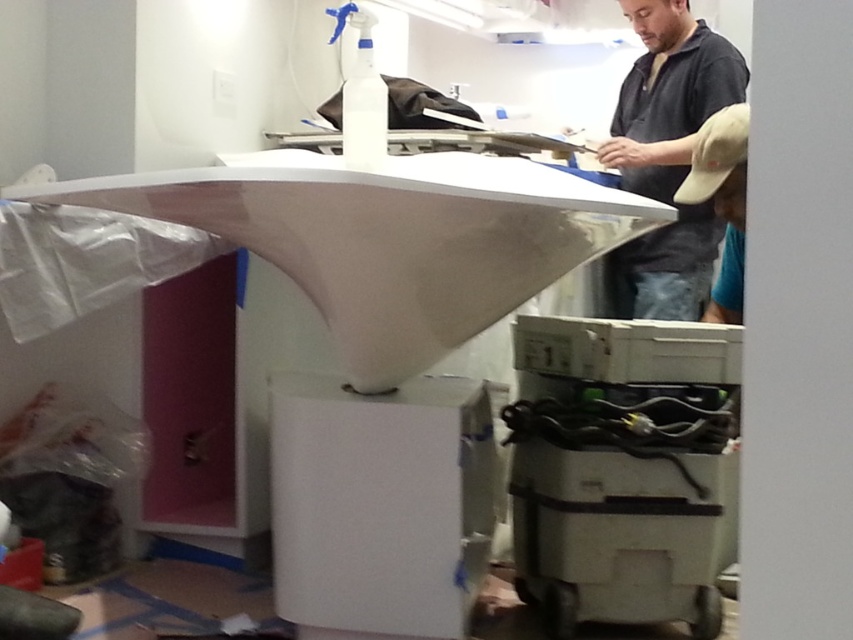
Based on the photo, you are an inspector checking the workspace. You notice the white glossy exhaust hood at center and the matte black shirt at upper center. Based on their positions, which object is closer to the floor?

The white glossy exhaust hood at center is closer to the floor because it is positioned below the matte black shirt at upper center.

You are an assistant in a workshop. You see a white plastic printer at lower right and a khaki fabric cap at right. Which object is closer to you?

The white plastic printer at lower right is closer to you because the khaki fabric cap at right is behind it.